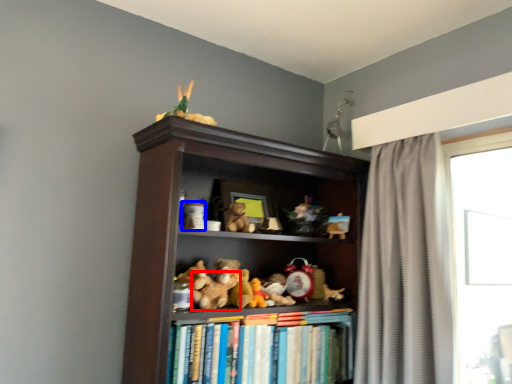
Question: Among these objects, which one is farthest to the camera, toy (highlighted by a red box) or toy (highlighted by a blue box)?

Choices:
 (A) toy
 (B) toy

Answer: (B)